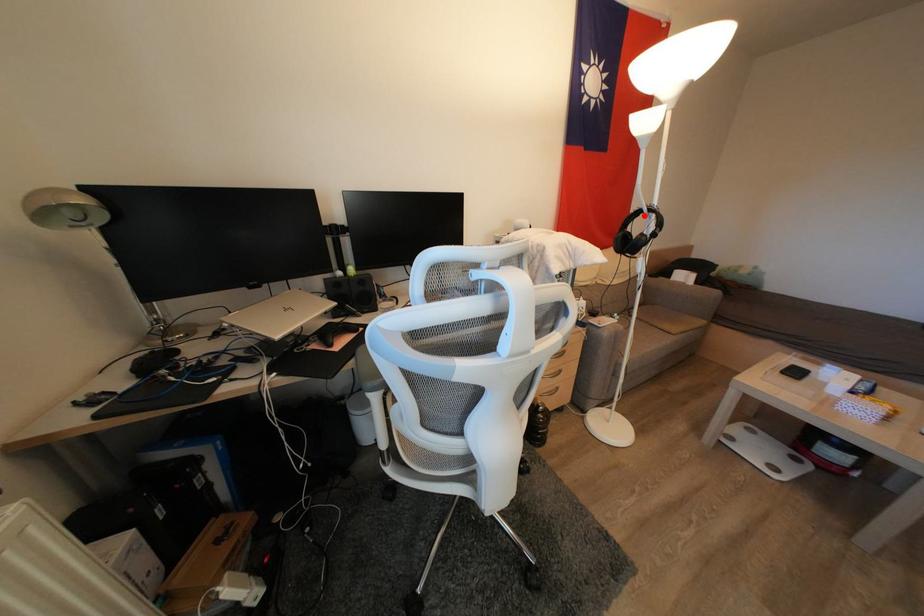
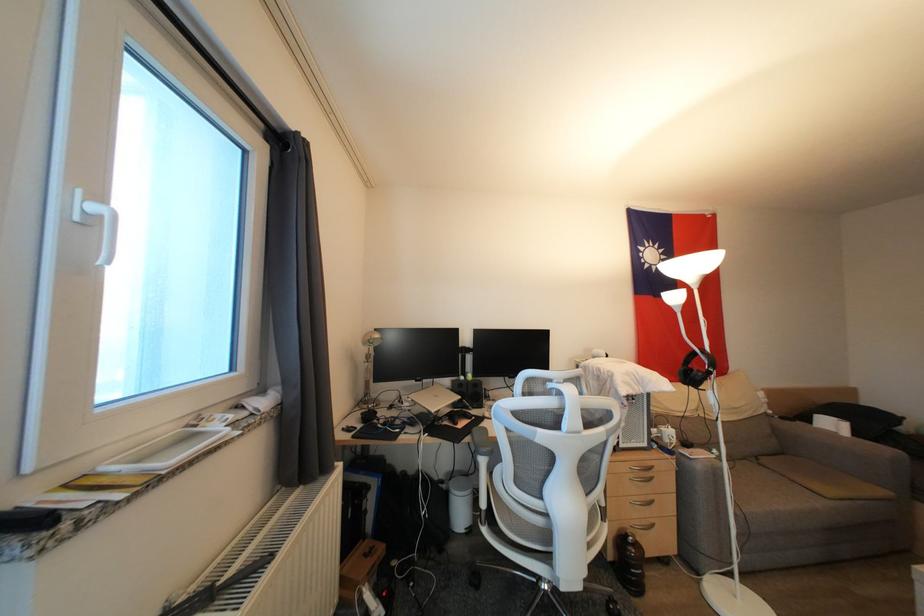
Where in the second image is the point corresponding to the highlighted location from the first image?

(699, 357)